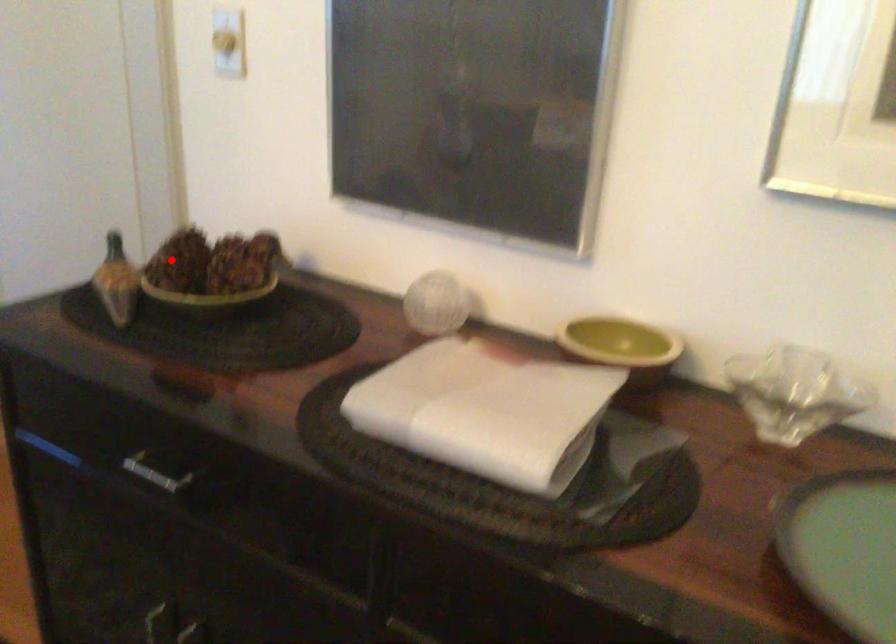
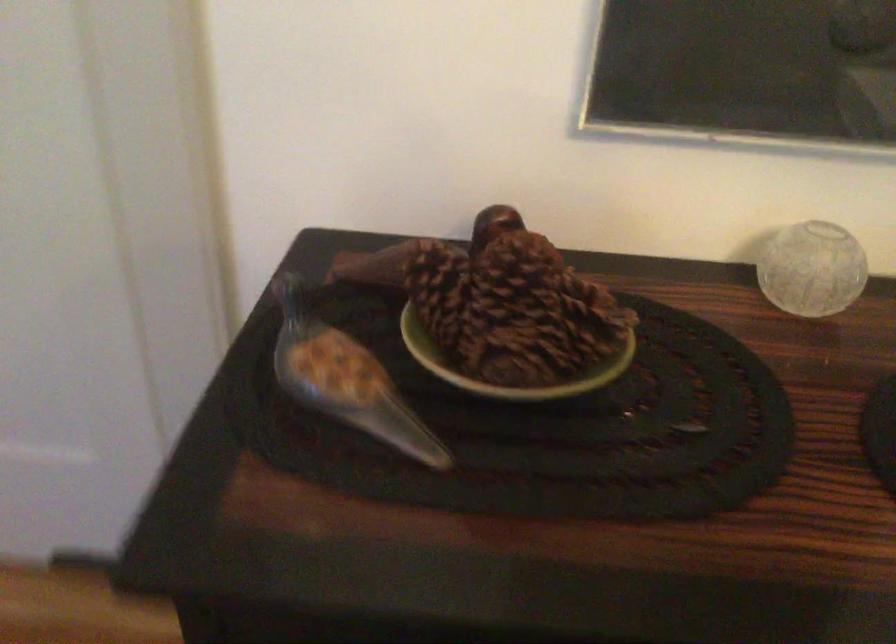
Question: I am providing you with two images of the same scene from different viewpoints. A red point is shown in image1. For the corresponding object point in image2, is it positioned nearer or farther from the camera?

Choices:
 (A) Nearer
 (B) Farther

Answer: (A)